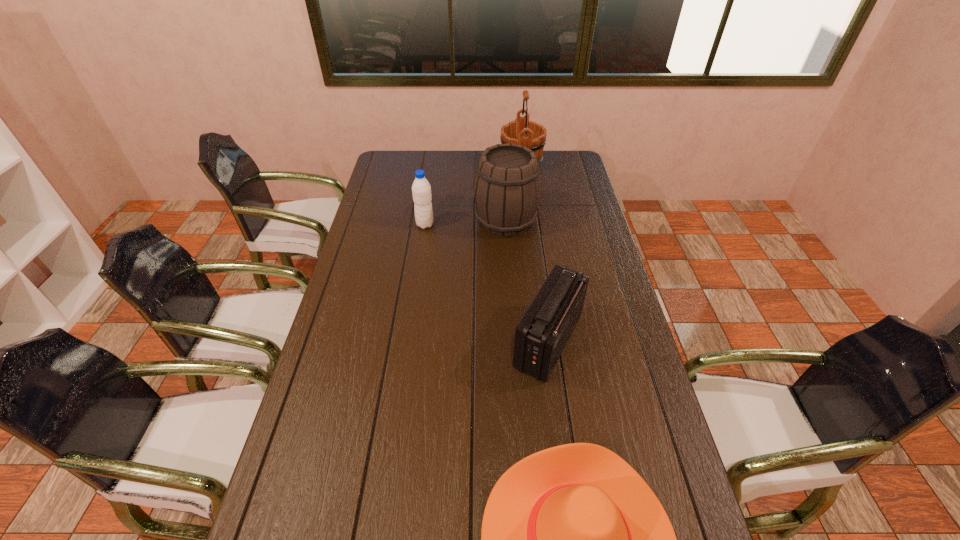
This screenshot has width=960, height=540. Identify the location of vacant region located 0.320m on the front panel of the second nearest object. (403, 341).

Find the location of a particular element. The width and height of the screenshot is (960, 540). blank space located on the front panel of the second nearest object is located at coordinates (397, 341).

In order to click on object that is at the far edge in this screenshot , I will do 530,134.

What are the coordinates of `object that is at the right edge` in the screenshot? It's located at (542, 333).

Find the location of a particular element. The height and width of the screenshot is (540, 960). blank space at the far edge of the desktop is located at coordinates (466, 150).

The height and width of the screenshot is (540, 960). In the image, there is a desktop. Find the location of `vacant area at the left edge`. vacant area at the left edge is located at coordinates (373, 247).

Identify the location of vacant space at the right edge of the desktop. The width and height of the screenshot is (960, 540). (580, 195).

The width and height of the screenshot is (960, 540). In order to click on free space between the radio receiver and the nearer wine bucket in this screenshot , I will do `click(527, 281)`.

Where is `free spot between the water bottle and the fourth farthest object`? The height and width of the screenshot is (540, 960). free spot between the water bottle and the fourth farthest object is located at coordinates (487, 283).

I want to click on blank region between the radio receiver and the farther wine bucket, so click(x=535, y=253).